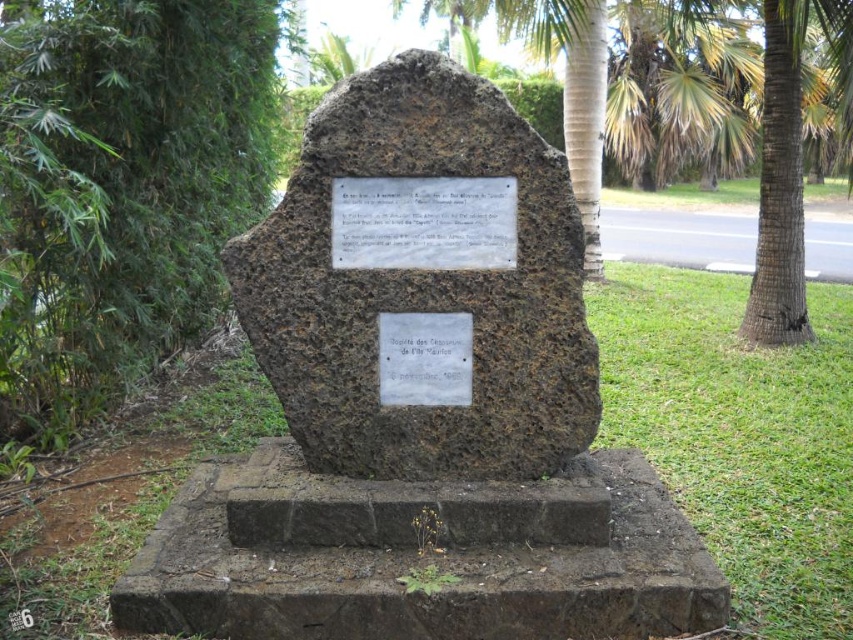
You are standing in the park and see the brown rough stone monument at center and the green leafy tree at left. Which object is positioned to the left?

The green leafy tree at left is positioned to the left of the brown rough stone monument at center.

You are a visitor at the park and want to read the text on the white metal plaque at center. Since the brown stone monument at center is in your way, can you easily move around it to get a clear view?

The brown stone monument at center is located below the white metal plaque at center, meaning the plaque is positioned higher up on the stone. Since the monument itself is the structure the plaque is attached to, you can likely stand closer or look upward to read the text without needing to move around the monument.

You are an archaeologist examining the brown stone monument at center and the brown rough stone monument at center. Which one has a greater width?

The brown stone monument at center has a greater width than the brown rough stone monument at center according to the description.